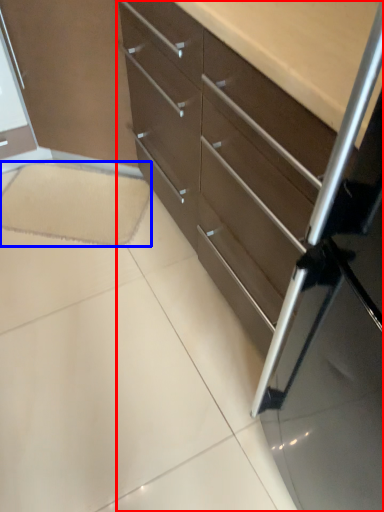
Question: Which object appears farthest to the camera in this image, chest of drawers (highlighted by a red box) or ceramic tile (highlighted by a blue box)?

Choices:
 (A) chest of drawers
 (B) ceramic tile

Answer: (B)